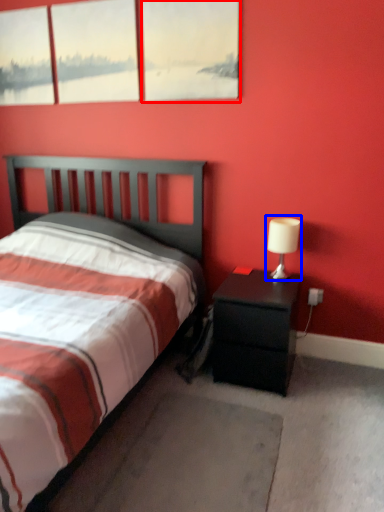
Question: Which object is closer to the camera taking this photo, window (highlighted by a red box) or table lamp (highlighted by a blue box)?

Choices:
 (A) window
 (B) table lamp

Answer: (A)